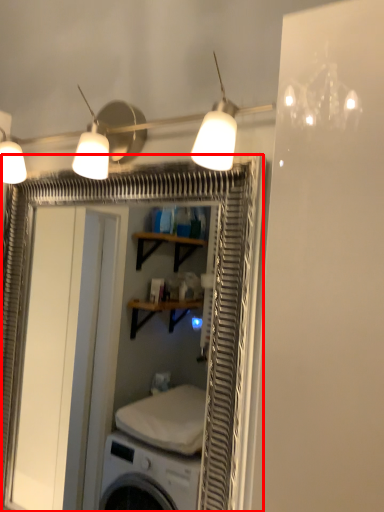
Question: From the image's perspective, where is screen door (annotated by the red box) located in relation to lamp in the image?

Choices:
 (A) above
 (B) below

Answer: (B)